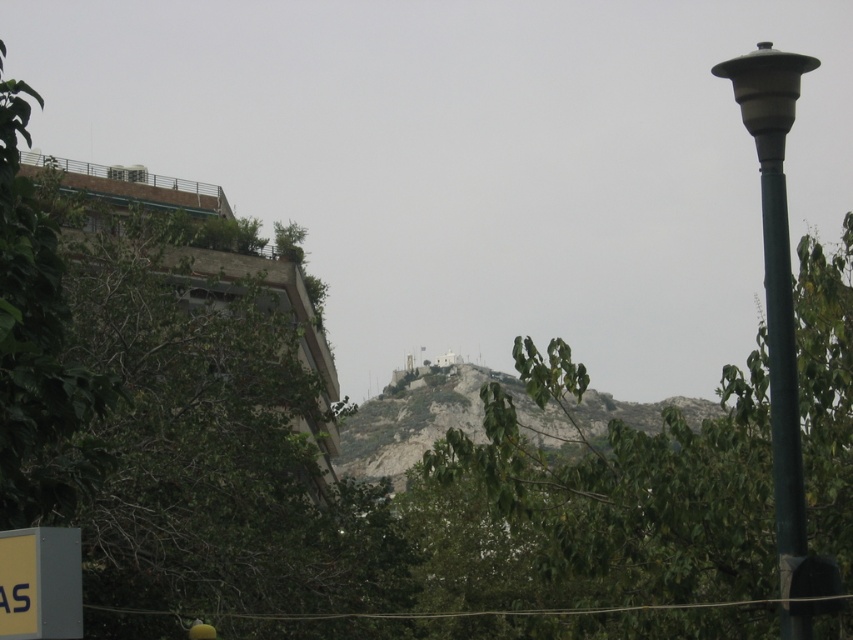
You are a city planner evaluating the placement of the green metallic pole at right and the gray plastic sign at lower left. Considering their widths, which object would require more horizontal space if you were to install a new structure next to them?

The green metallic pole at right requires more horizontal space because its width surpasses that of the gray plastic sign at lower left.

You are a city planner analyzing this urban area. You need to determine which object occupies more space in the image for zoning purposes. Which is larger in size between the rocky gray hillside at center and the matte green pole at right?

The rocky gray hillside at center is larger in size than the matte green pole at right, so it occupies more space in the image.

You are standing in the urban landscape scene and want to determine which of the two points, point (x=527, y=429) or point (x=795, y=630), is closer to you. Based on the scene description, which point is nearer?

Point (x=527, y=429) is further to the viewer than point (x=795, y=630). Wait, no, the description says the opposite. Let me check again. The Objects Description states that point (x=527, y=429) is further to the viewer than point (x=795, y=630). Hmm, so if point A is further than point B, then point B is closer to the viewer. Therefore, the answer should be that point (x=795, y=630) is closer. But the user might have made a mistake here. Wait, the user provided the Objects Description as given. So according to the O